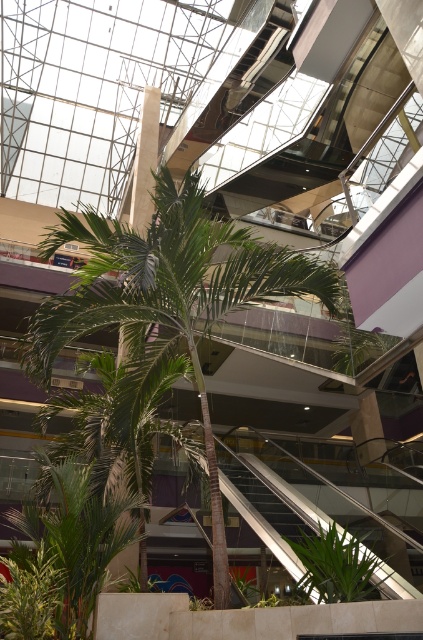
Question: Can you confirm if metallic silver escalator at lower center is smaller than green leafy plant at center?

Choices:
 (A) no
 (B) yes

Answer: (B)

Question: Can you confirm if metallic silver escalator at lower center is bigger than green leafy plant at center?

Choices:
 (A) no
 (B) yes

Answer: (A)

Question: Is metallic silver escalator at lower center positioned at the back of green leafy plant at center?

Choices:
 (A) yes
 (B) no

Answer: (A)

Question: Among these objects, which one is nearest to the camera?

Choices:
 (A) metallic silver escalator at lower center
 (B) green leafy plant at center

Answer: (B)

Question: Which of the following is the closest to the observer?

Choices:
 (A) (362, 576)
 (B) (301, 566)

Answer: (A)